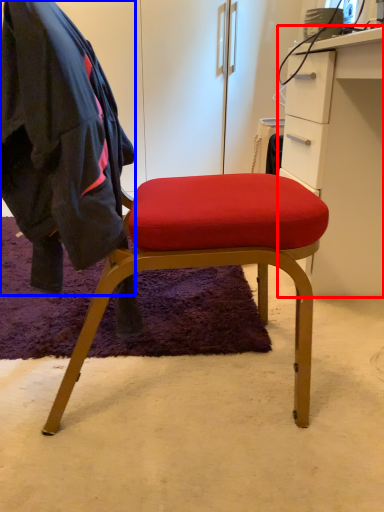
Question: Which of the following is the closest to the observer, cabinetry (highlighted by a red box) or clothing (highlighted by a blue box)?

Choices:
 (A) cabinetry
 (B) clothing

Answer: (B)